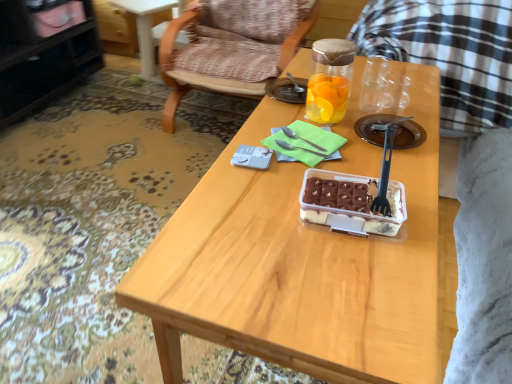
Question: Is transparent glass jar at center to the left or to the right of black glossy cabinet at upper left in the image?

Choices:
 (A) left
 (B) right

Answer: (B)

Question: Considering the positions of transparent glass jar at center and black glossy cabinet at upper left in the image, is transparent glass jar at center wider or thinner than black glossy cabinet at upper left?

Choices:
 (A) thin
 (B) wide

Answer: (A)

Question: Based on their relative distances, which object is nearer to the black glossy cabinet at upper left?

Choices:
 (A) wooden armchair at center
 (B) translucent plastic container at center
 (C) black plastic fork at center, which is the first fork in front-to-back order
 (D) satin silver fork at center, the second fork viewed from the back
 (E) satin silver fork at center, arranged as the 3th fork when viewed from the front

Answer: (A)

Question: Estimate the real-world distances between objects in this image. Which object is closer to the black plastic fork at center, the 3th fork when ordered from back to front?

Choices:
 (A) satin silver fork at center, the second fork in the front-to-back sequence
 (B) black glossy cabinet at upper left
 (C) transparent glass jar at center
 (D) satin silver fork at center, arranged as the 3th fork when viewed from the front
 (E) wooden armchair at center

Answer: (A)